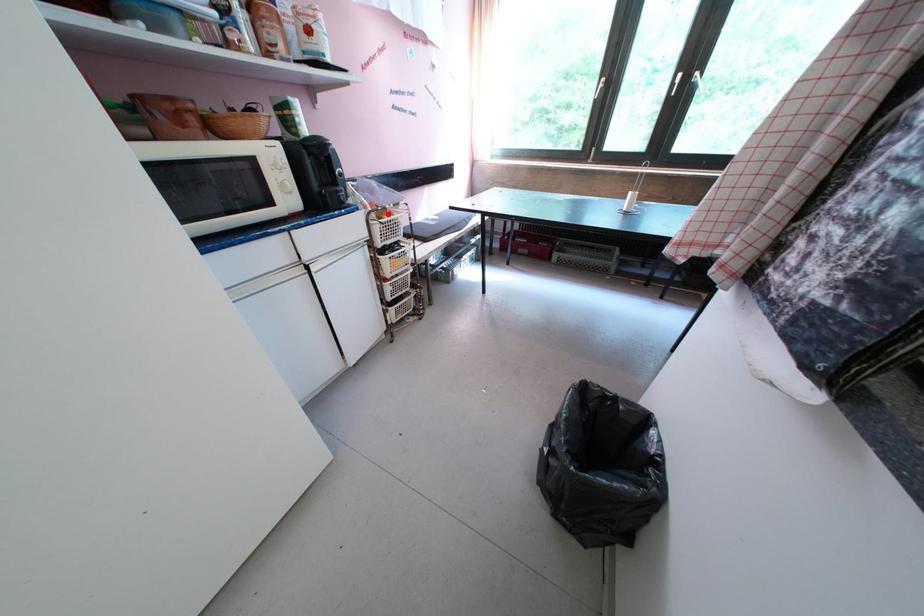
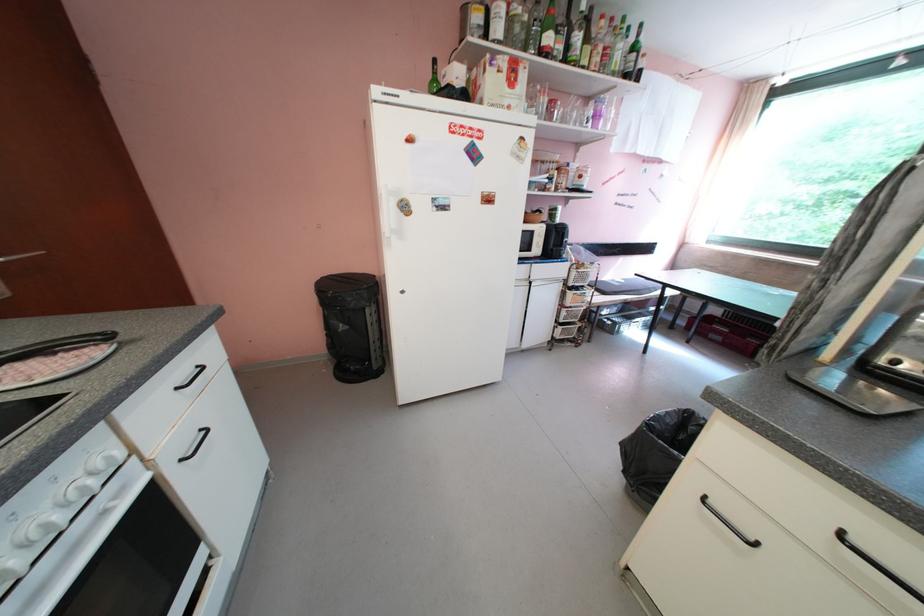
Question: A red point is marked in image1. In image2, is the corresponding 3D point closer to the camera or farther? Reply with the corresponding letter.

Choices:
 (A) The corresponding 3D point is closer.
 (B) The corresponding 3D point is farther.

Answer: (B)